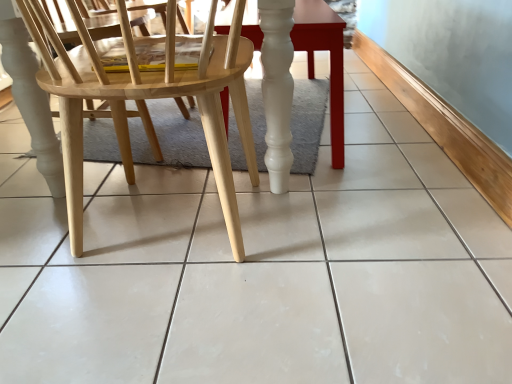
Question: Is smooth glossy wood table at center positioned beyond the bounds of natural wood chair at left?

Choices:
 (A) no
 (B) yes

Answer: (B)

Question: Can you confirm if smooth glossy wood table at center is wider than natural wood chair at left?

Choices:
 (A) yes
 (B) no

Answer: (B)

Question: Would you say smooth glossy wood table at center is a long distance from natural wood chair at left?

Choices:
 (A) no
 (B) yes

Answer: (A)

Question: Does smooth glossy wood table at center contain natural wood chair at left?

Choices:
 (A) yes
 (B) no

Answer: (B)

Question: Can you confirm if smooth glossy wood table at center is bigger than natural wood chair at left?

Choices:
 (A) no
 (B) yes

Answer: (B)

Question: Is smooth glossy wood table at center thinner than natural wood chair at left?

Choices:
 (A) no
 (B) yes

Answer: (B)

Question: From the image's perspective, is natural wood chair at left on smooth glossy wood table at center?

Choices:
 (A) yes
 (B) no

Answer: (B)

Question: From a real-world perspective, is natural wood chair at left on smooth glossy wood table at center?

Choices:
 (A) no
 (B) yes

Answer: (B)

Question: Are natural wood chair at left and smooth glossy wood table at center making contact?

Choices:
 (A) yes
 (B) no

Answer: (B)

Question: Does natural wood chair at left have a smaller size compared to smooth glossy wood table at center?

Choices:
 (A) no
 (B) yes

Answer: (B)

Question: Can you confirm if natural wood chair at left is taller than smooth glossy wood table at center?

Choices:
 (A) yes
 (B) no

Answer: (A)

Question: Is natural wood chair at left to the right of smooth glossy wood table at center from the viewer's perspective?

Choices:
 (A) yes
 (B) no

Answer: (B)

Question: From the image's perspective, is natural wood chair at left located above or below smooth glossy wood table at center?

Choices:
 (A) above
 (B) below

Answer: (B)